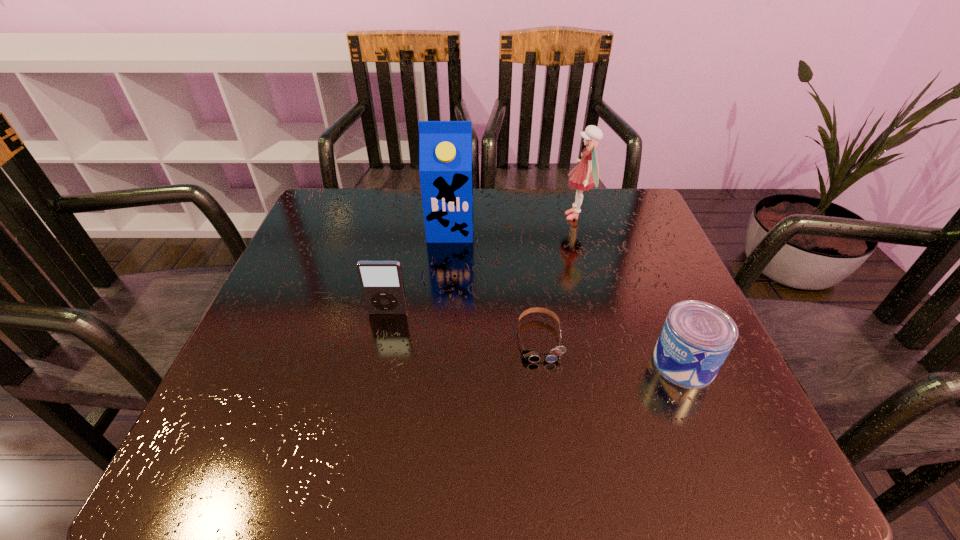
Locate an element on the screen. the second object from left to right is located at coordinates (445, 147).

Identify the location of doll. Image resolution: width=960 pixels, height=540 pixels. (586, 174).

The width and height of the screenshot is (960, 540). What are the coordinates of `iPod` in the screenshot? It's located at pyautogui.click(x=382, y=285).

Find the location of a particular element. The height and width of the screenshot is (540, 960). the third farthest object is located at coordinates (382, 285).

Locate an element on the screen. The width and height of the screenshot is (960, 540). the fourth tallest object is located at coordinates (696, 338).

I want to click on the rightmost object, so click(x=696, y=338).

What are the coordinates of `goggles` in the screenshot? It's located at (554, 355).

Find the location of `the third object from right to left`. the third object from right to left is located at coordinates coord(554,355).

Locate an element on the screen. The image size is (960, 540). blank space located 0.150m with the cap open on the carton is located at coordinates (445, 287).

Where is `free space located on the front-facing side of the doll`? This screenshot has height=540, width=960. free space located on the front-facing side of the doll is located at coordinates (476, 216).